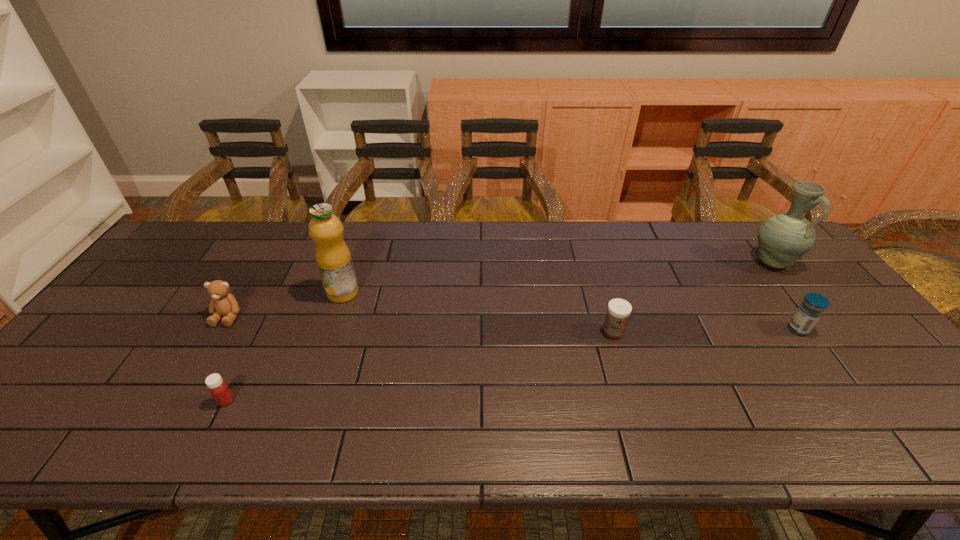
At what (x,y) coordinates should I click in order to perform the action: click on free space between the leftmost object and the nearest medicine. Please return your answer as a coordinate pair (x, y). The width and height of the screenshot is (960, 540). Looking at the image, I should click on (228, 359).

Image resolution: width=960 pixels, height=540 pixels. Find the location of `vacant space that is in between the fifth object from right to left and the rightmost medicine`. vacant space that is in between the fifth object from right to left and the rightmost medicine is located at coordinates (512, 365).

Locate an element on the screen. empty location between the second object from left to right and the fifth nearest object is located at coordinates (285, 347).

Image resolution: width=960 pixels, height=540 pixels. I want to click on free spot between the teddy bear and the second farthest object, so click(285, 305).

Identify the location of the second closest object to the teddy bear. This screenshot has height=540, width=960. (218, 388).

Where is `object that is the fourth closest to the leftmost object`? This screenshot has width=960, height=540. object that is the fourth closest to the leftmost object is located at coordinates (811, 309).

Where is `medicine that is the third closest one to the leftmost object`? medicine that is the third closest one to the leftmost object is located at coordinates (811, 309).

Locate an element on the screen. medicine that is the second nearest to the rightmost medicine is located at coordinates (218, 388).

Where is `free space that satisfies the following two spatial constraints: 1. on the front-facing side of the second medicine from right to left; 2. on the right side of the teddy bear`? free space that satisfies the following two spatial constraints: 1. on the front-facing side of the second medicine from right to left; 2. on the right side of the teddy bear is located at coordinates (219, 331).

Find the location of a particular element. The image size is (960, 540). free space that satisfies the following two spatial constraints: 1. on the front-facing side of the leftmost object; 2. on the left side of the fourth object from left to right is located at coordinates (219, 331).